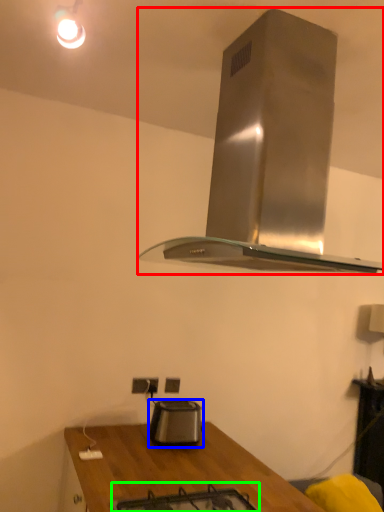
Question: Estimate the real-world distances between objects in this image. Which object is farther from home appliance (highlighted by a red box), kitchen appliance (highlighted by a blue box) or gas stove (highlighted by a green box)?

Choices:
 (A) kitchen appliance
 (B) gas stove

Answer: (A)